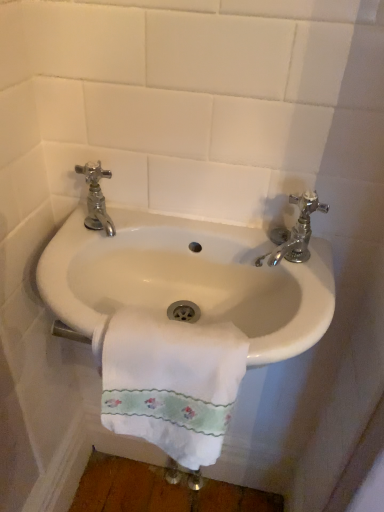
Question: From their relative heights in the image, would you say white cotton towel at center is taller or shorter than chrome/metallic faucet at upper left, arranged as the 1th tap when viewed from the left?

Choices:
 (A) short
 (B) tall

Answer: (B)

Question: Considering the relative positions of white cotton towel at center and chrome/metallic faucet at upper left, arranged as the 1th tap when viewed from the left, in the image provided, is white cotton towel at center to the left or to the right of chrome/metallic faucet at upper left, arranged as the 1th tap when viewed from the left,?

Choices:
 (A) right
 (B) left

Answer: (A)

Question: Which object is the farthest from the white cotton towel at center?

Choices:
 (A) white glossy sink at center
 (B) chrome/metallic faucet at right, the 2th tap positioned from the left
 (C) chrome/metallic faucet at upper left, arranged as the 1th tap when viewed from the left

Answer: (C)

Question: Which is nearer to the chrome/metallic faucet at right, the 2th tap positioned from the left?

Choices:
 (A) white glossy sink at center
 (B) white cotton towel at center
 (C) chrome/metallic faucet at upper left, arranged as the 1th tap when viewed from the left

Answer: (A)